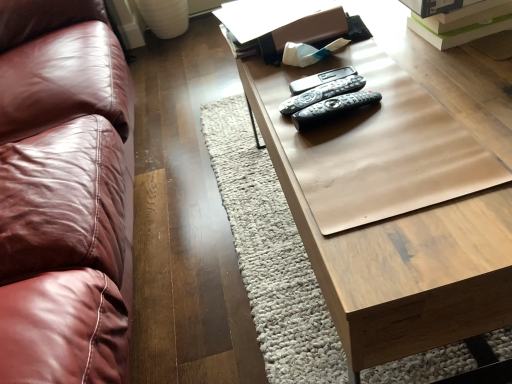
This screenshot has width=512, height=384. What are the coordinates of `vacant space in front of black plastic remote at center, the third remote from the front` in the screenshot? It's located at (366, 142).